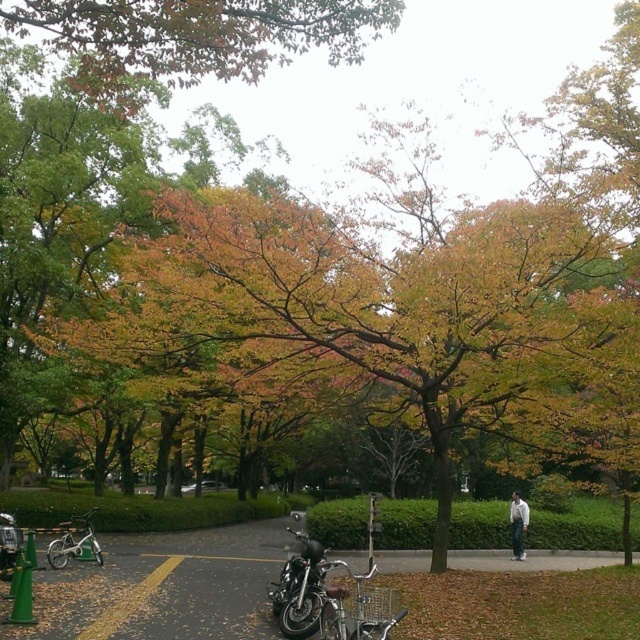
Question: From the image, what is the correct spatial relationship of shiny metallic bicycle at center in relation to white shirt at center?

Choices:
 (A) below
 (B) above

Answer: (B)

Question: Is shiny chrome motorcycle at center positioned behind white shirt at center?

Choices:
 (A) yes
 (B) no

Answer: (B)

Question: Which object is closer to the camera taking this photo?

Choices:
 (A) silver metallic bicycle at lower left
 (B) orange leafy tree at upper center

Answer: (B)

Question: Is orange leafy tree at upper center bigger than shiny chrome motorcycle at center?

Choices:
 (A) yes
 (B) no

Answer: (A)

Question: Among these objects, which one is farthest from the camera?

Choices:
 (A) shiny black motorcycle at lower left
 (B) shiny chrome motorcycle at center
 (C) silver metallic bicycle at lower left

Answer: (C)

Question: Among these points, which one is farthest from the camera?

Choices:
 (A) (516, 540)
 (B) (10, 515)

Answer: (A)